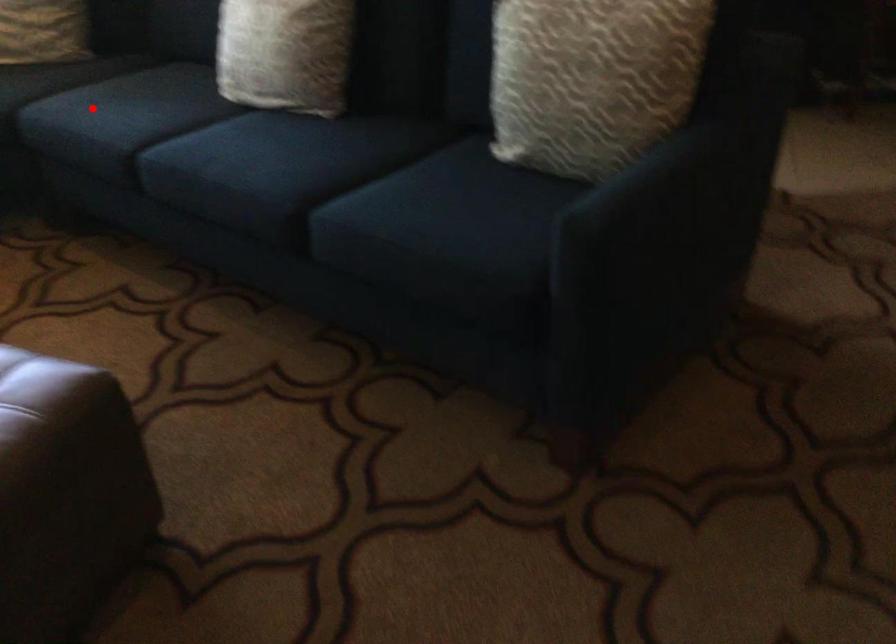
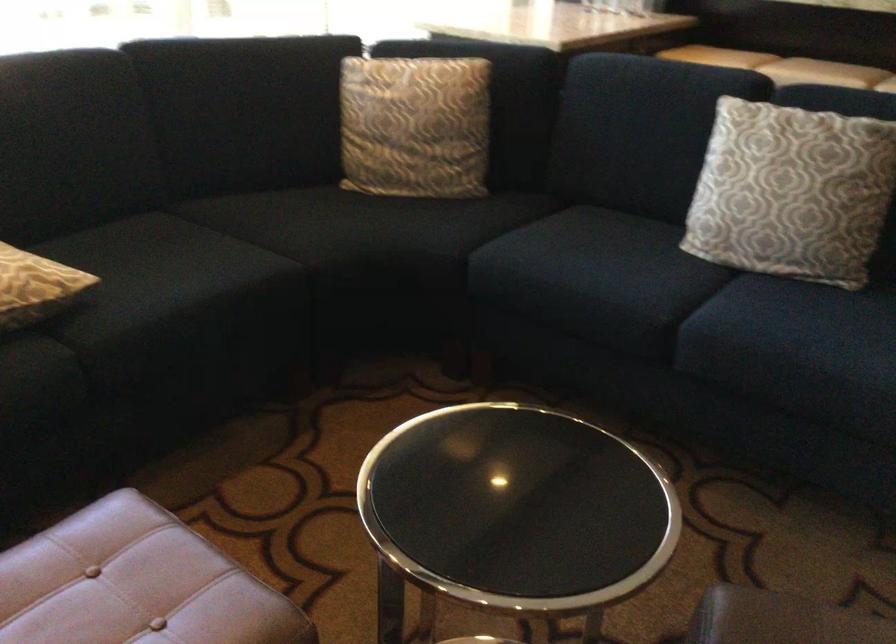
Find the pixel in the second image that matches the highlighted location in the first image.

(590, 274)